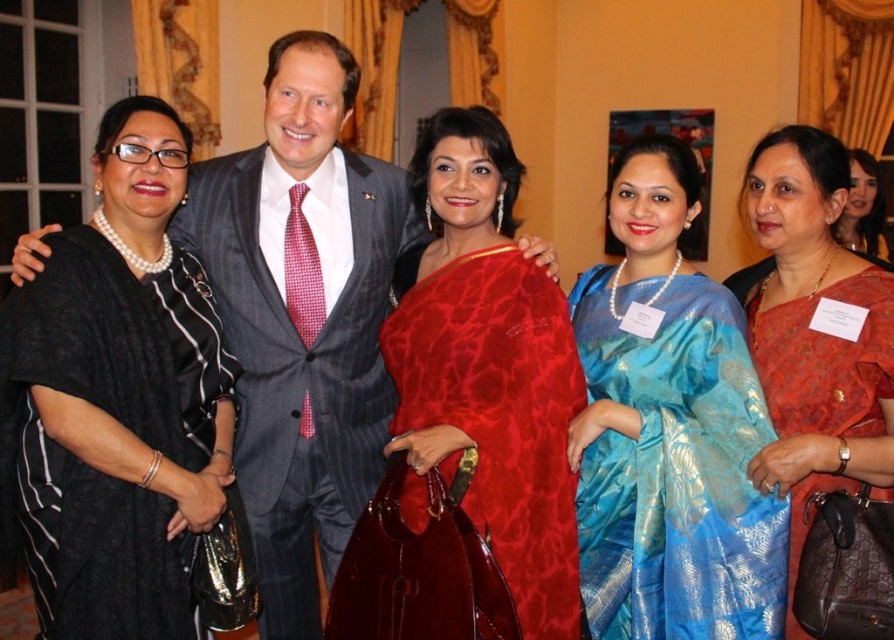
You are a photographer adjusting the lighting for a group photo. You notice the matte gray suit at center and the matte red sari at center. Which one is closer to the camera?

The matte gray suit at center is closer to the camera because the matte red sari at center is positioned behind it.